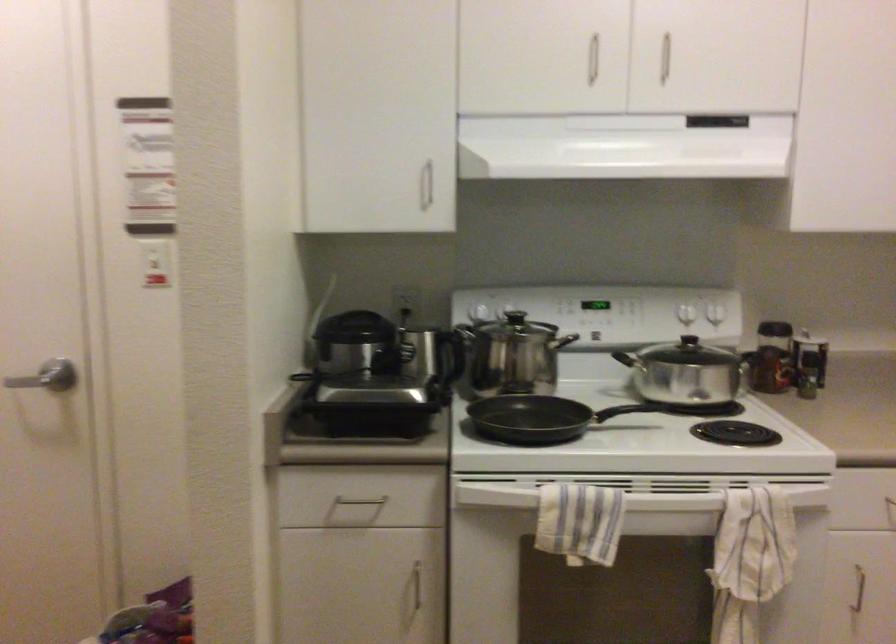
What do you see at coordinates (625, 497) in the screenshot? I see `the white oven handle` at bounding box center [625, 497].